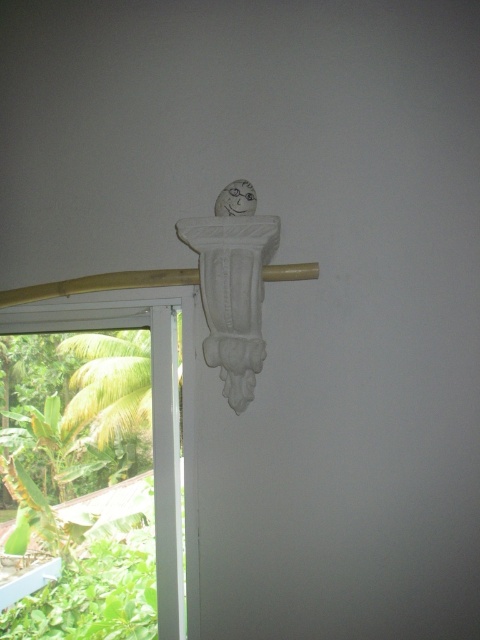
Question: Can you confirm if transparent glass window at left is thinner than white wood beam at upper center?

Choices:
 (A) no
 (B) yes

Answer: (B)

Question: Which object appears farthest from the camera in this image?

Choices:
 (A) transparent glass window at left
 (B) white wood beam at upper center

Answer: (A)

Question: Is transparent glass window at left below white wood beam at upper center?

Choices:
 (A) yes
 (B) no

Answer: (A)

Question: Does transparent glass window at left appear under white wood beam at upper center?

Choices:
 (A) no
 (B) yes

Answer: (B)

Question: Which point is farther to the camera?

Choices:
 (A) white wood beam at upper center
 (B) transparent glass window at left

Answer: (B)